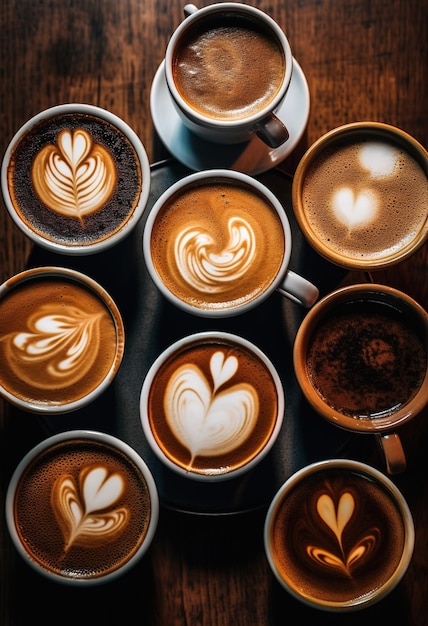
The image size is (428, 626). What are the coordinates of `cups of coffee` in the screenshot? It's located at (218, 74), (83, 177), (213, 248), (346, 200), (378, 340), (211, 406), (68, 342), (90, 518), (341, 548).